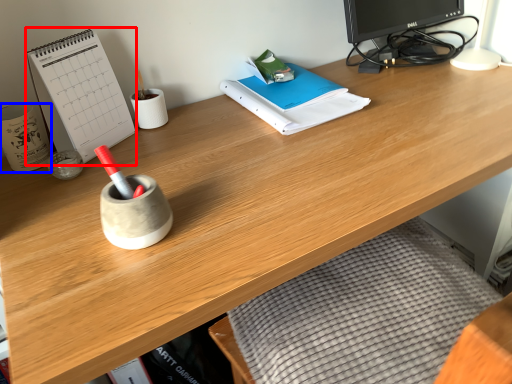
Question: Which object appears closest to the camera in this image, paperback book (highlighted by a red box) or stationery (highlighted by a blue box)?

Choices:
 (A) paperback book
 (B) stationery

Answer: (A)